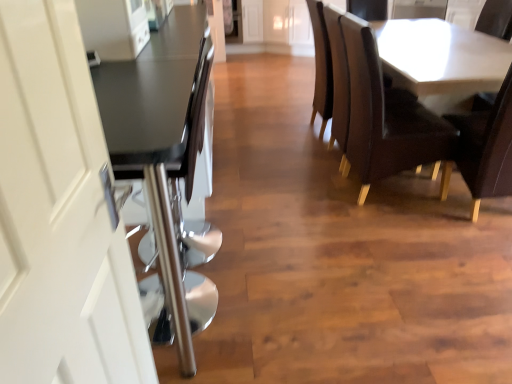
Question: Does white glossy table at upper right, the 2th table from the left, have a greater width compared to white glossy door handle at left?

Choices:
 (A) no
 (B) yes

Answer: (B)

Question: From a real-world perspective, is white glossy table at upper right, which appears as the first table when viewed from the back, located higher than white glossy door handle at left?

Choices:
 (A) yes
 (B) no

Answer: (B)

Question: Is white glossy table at upper right, which is the 2th table in front-to-back order, shorter than white glossy door handle at left?

Choices:
 (A) no
 (B) yes

Answer: (B)

Question: Can you confirm if white glossy table at upper right, the 2th table from the left, is positioned to the right of white glossy door handle at left?

Choices:
 (A) no
 (B) yes

Answer: (B)

Question: Is white glossy table at upper right, the first table from the right, bigger than white glossy door handle at left?

Choices:
 (A) yes
 (B) no

Answer: (A)

Question: Is white glossy table at upper right, the 2th table from the left, oriented away from white glossy door handle at left?

Choices:
 (A) yes
 (B) no

Answer: (B)

Question: Can you see white glossy door handle at left touching matte black table at left, which appears as the 2th table when viewed from the back?

Choices:
 (A) yes
 (B) no

Answer: (B)

Question: Is matte black table at left, acting as the 1th table starting from the left, at the back of white glossy door handle at left?

Choices:
 (A) no
 (B) yes

Answer: (A)

Question: Does white glossy door handle at left come behind matte black table at left, acting as the 1th table starting from the left?

Choices:
 (A) yes
 (B) no

Answer: (B)

Question: Does white glossy door handle at left have a smaller size compared to matte black table at left, acting as the 1th table starting from the left?

Choices:
 (A) yes
 (B) no

Answer: (A)

Question: Is white glossy door handle at left at the right side of matte black table at left, acting as the 1th table starting from the left?

Choices:
 (A) yes
 (B) no

Answer: (A)

Question: Is white glossy door handle at left taller than matte black table at left, the 2th table when ordered from right to left?

Choices:
 (A) yes
 (B) no

Answer: (A)

Question: From a real-world perspective, is white glossy table at upper right, which is the 2th table in front-to-back order, on matte black table at left, acting as the 1th table starting from the left?

Choices:
 (A) yes
 (B) no

Answer: (B)